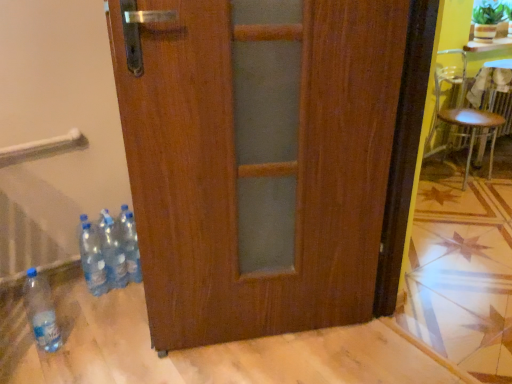
The width and height of the screenshot is (512, 384). Find the location of `free location in front of blue plastic bottle at lower left, which is the 4th bottle from left to right`. free location in front of blue plastic bottle at lower left, which is the 4th bottle from left to right is located at coordinates (114, 306).